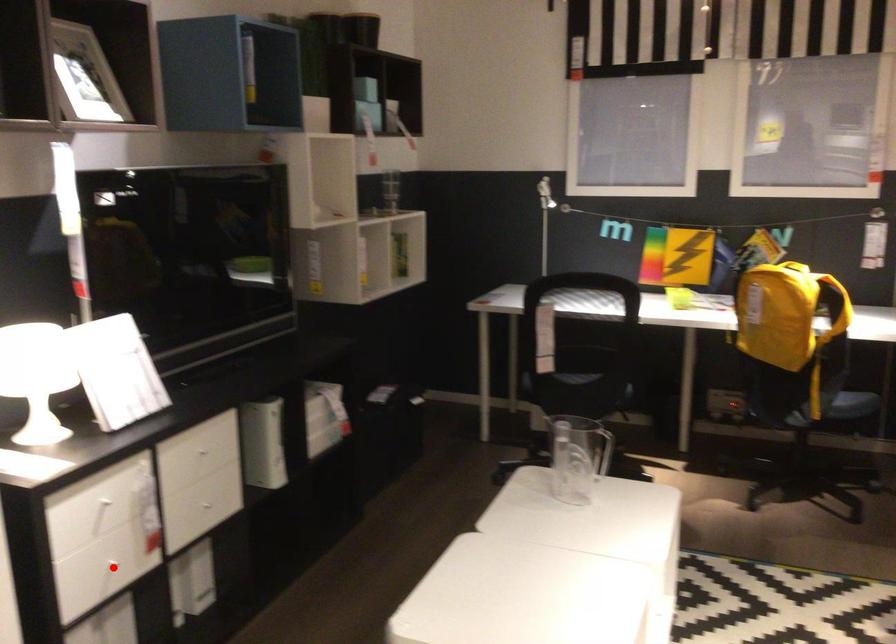
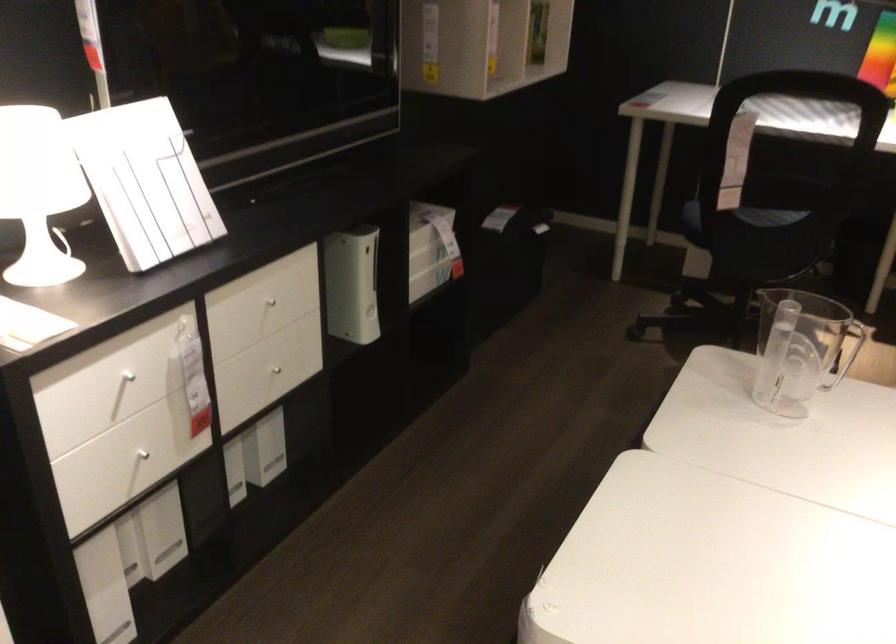
Question: A red point is marked in image1. In image2, is the corresponding 3D point closer to the camera or farther? Reply with the corresponding letter.

Choices:
 (A) The corresponding 3D point is closer.
 (B) The corresponding 3D point is farther.

Answer: (A)